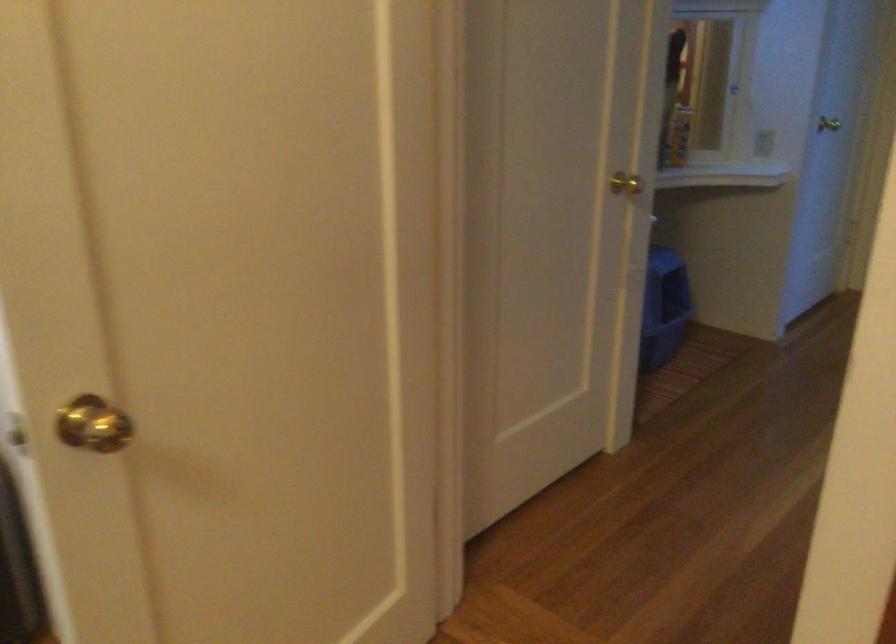
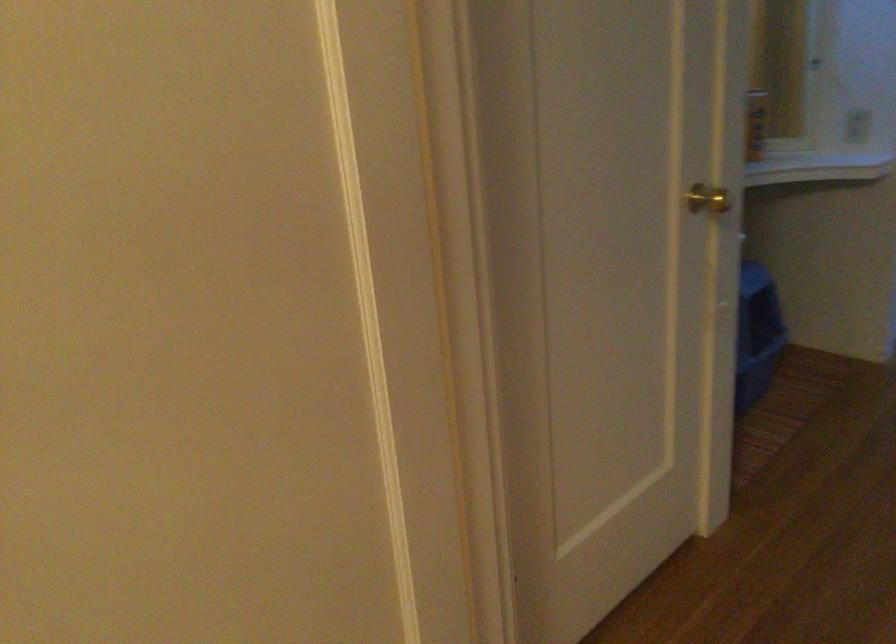
Question: The camera is either moving clockwise (left) or counter-clockwise (right) around the object. The first image is from the beginning of the video and the second image is from the end. Is the camera moving left or right when shooting the video?

Choices:
 (A) Left
 (B) Right

Answer: (B)